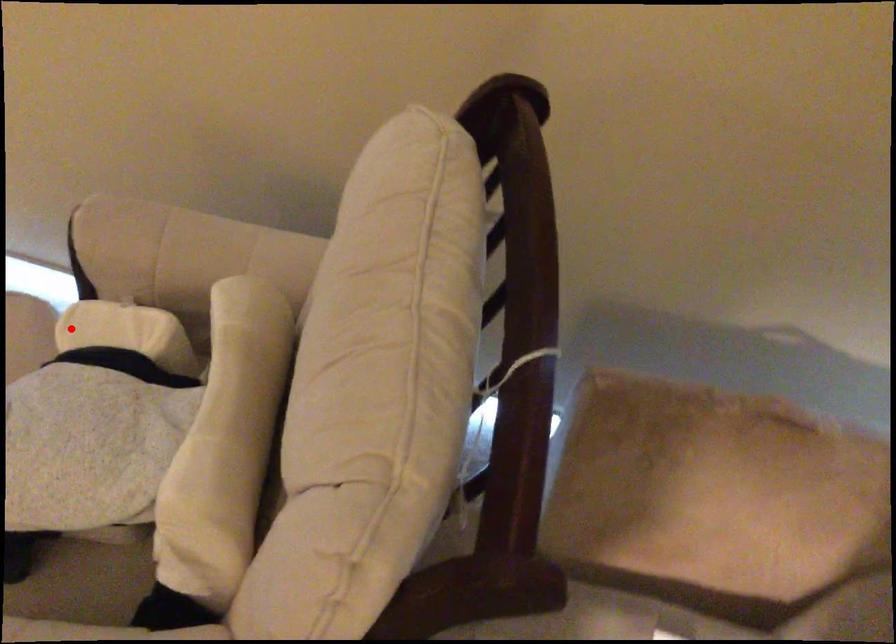
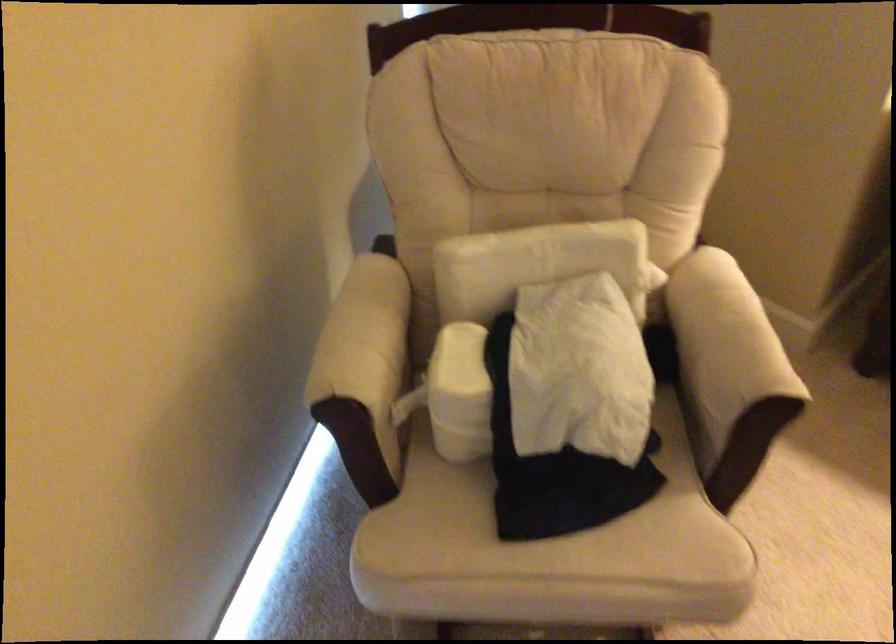
Locate, in the second image, the point that corresponds to the highlighted location in the first image.

(460, 393)